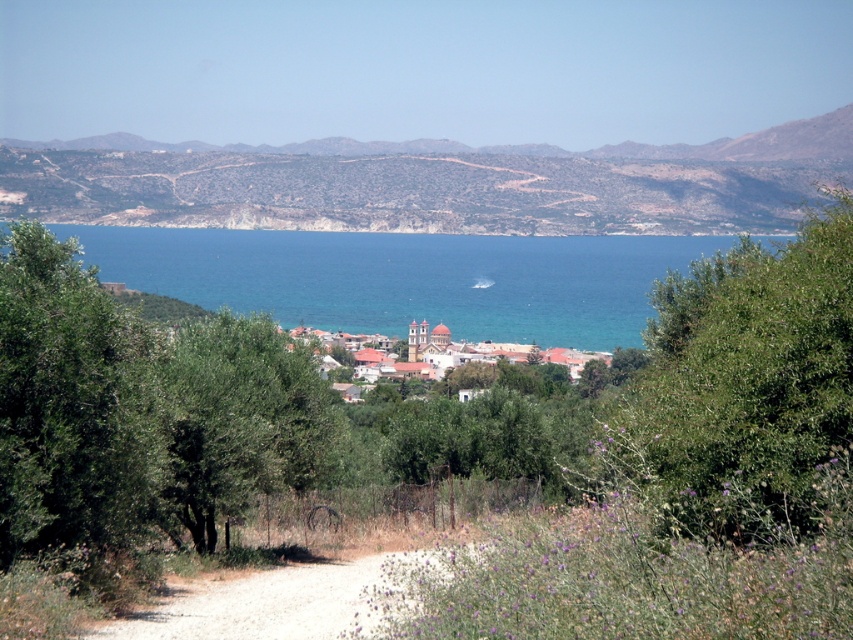
Question: Which of the following is the farthest from the observer?

Choices:
 (A) green leafy tree at left
 (B) white stucco buildings at center
 (C) blue water at center

Answer: (B)

Question: Considering the relative positions of green leafy tree at left and dirt/gravel path at center in the image provided, where is green leafy tree at left located with respect to dirt/gravel path at center?

Choices:
 (A) below
 (B) above

Answer: (B)

Question: Among these objects, which one is nearest to the camera?

Choices:
 (A) white stucco buildings at center
 (B) blue water at center

Answer: (B)

Question: Among these objects, which one is farthest from the camera?

Choices:
 (A) white stucco buildings at center
 (B) blue water at center

Answer: (A)

Question: Is blue water at center closer to the viewer compared to green leafy tree at left?

Choices:
 (A) no
 (B) yes

Answer: (A)

Question: Can you confirm if green leafy bush at right is wider than white stucco buildings at center?

Choices:
 (A) no
 (B) yes

Answer: (A)